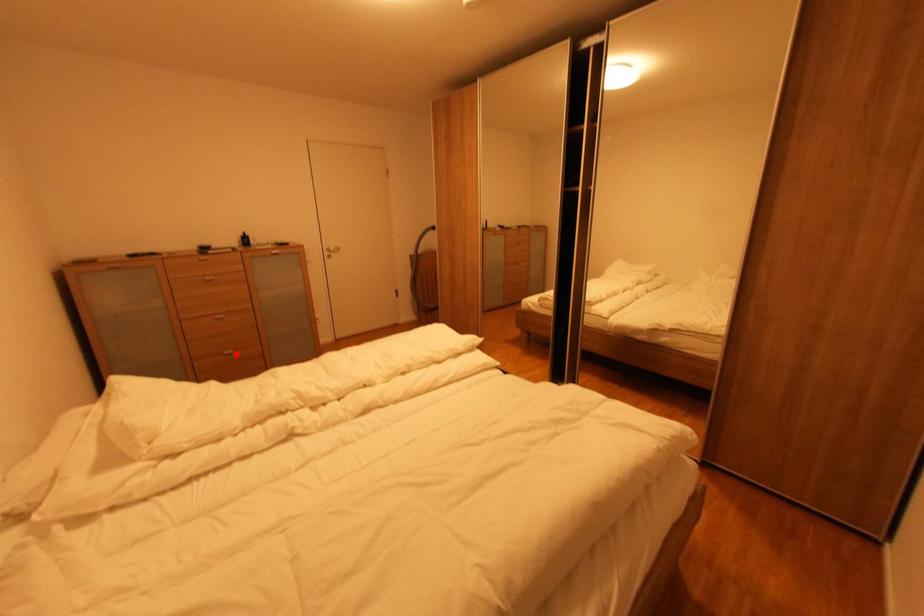
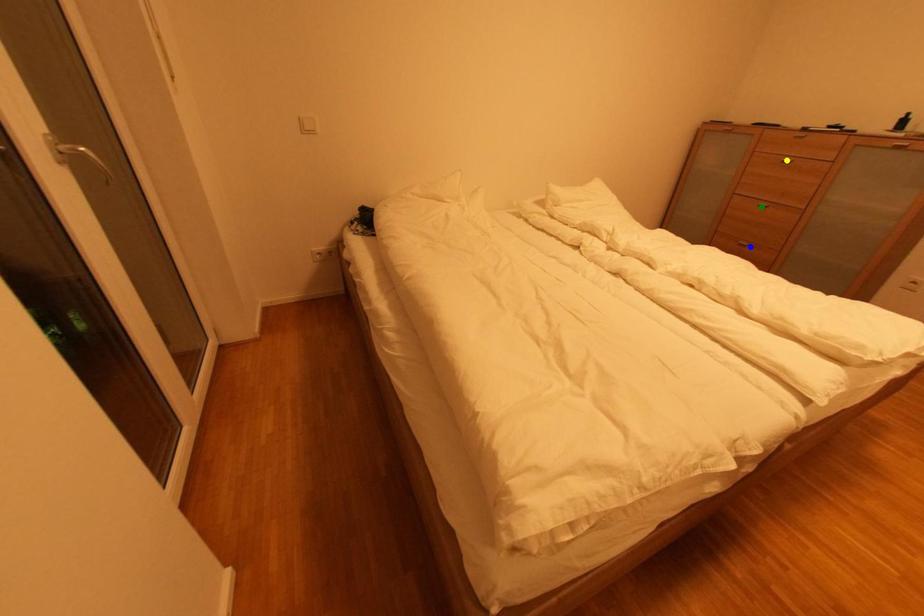
Question: I am providing you with two images of the same scene from different viewpoints. A red point is marked on the first image. You are given multiple points on the second image. Which spot in image 2 lines up with the point in image 1?

Choices:
 (A) yellow point
 (B) green point
 (C) blue point

Answer: (C)